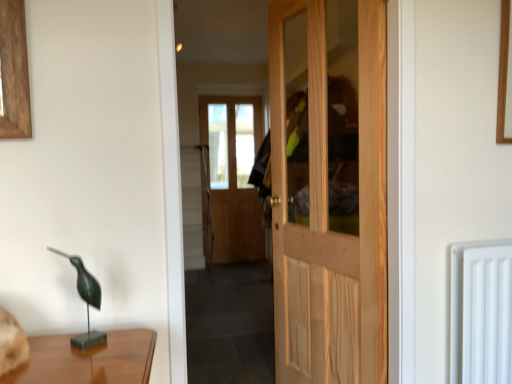
Where is `natural wood door at center`? This screenshot has height=384, width=512. natural wood door at center is located at coordinates (328, 196).

What do you see at coordinates (328, 196) in the screenshot?
I see `natural wood door at center` at bounding box center [328, 196].

Where is `white plastic radiator at right`? The image size is (512, 384). white plastic radiator at right is located at coordinates (481, 312).

Is natural wood door at center not near white plastic radiator at right?

No, there isn't a large distance between natural wood door at center and white plastic radiator at right.

Where is `door behind the white plastic radiator at right`? The height and width of the screenshot is (384, 512). door behind the white plastic radiator at right is located at coordinates (328, 196).

Is point (375, 76) more distant than point (496, 301)?

Yes, point (375, 76) is farther from viewer.

From a real-world perspective, is natural wood door at center positioned under white plastic radiator at right based on gravity?

No, from a real-world perspective, natural wood door at center is not below white plastic radiator at right.

From a real-world perspective, is natural wood door at center beneath green patina metal bird at left?

Actually, natural wood door at center is physically above green patina metal bird at left in the real world.

Looking at this image, how far apart are natural wood door at center and green patina metal bird at left?

A distance of 1.25 meters exists between natural wood door at center and green patina metal bird at left.

Considering the sizes of objects natural wood door at center and green patina metal bird at left in the image provided, who is thinner, natural wood door at center or green patina metal bird at left?

green patina metal bird at left is thinner.

Does natural wood door at center have a smaller size compared to green patina metal bird at left?

Incorrect, natural wood door at center is not smaller in size than green patina metal bird at left.

Locate an element on the screen. radiator lying below the natural wood door at center (from the image's perspective) is located at coordinates (481, 312).

How different are the orientations of white plastic radiator at right and natural wood door at center in degrees?

The angle between the facing direction of white plastic radiator at right and the facing direction of natural wood door at center is 72.3 degrees.

Would you say white plastic radiator at right is to the left or to the right of natural wood door at center in the picture?

From the image, it's evident that white plastic radiator at right is to the right of natural wood door at center.

In the scene shown: Which of these two, green patina metal bird at left or natural wood door at center, is smaller?

green patina metal bird at left is smaller.

From a real-world perspective, between green patina metal bird at left and natural wood door at center, who is vertically lower?

From a 3D spatial view, green patina metal bird at left is below.

Considering the positions of objects green patina metal bird at left and natural wood door at center in the image provided, who is behind, green patina metal bird at left or natural wood door at center?

natural wood door at center.

Is green patina metal bird at left with white plastic radiator at right?

There is a gap between green patina metal bird at left and white plastic radiator at right.

Based on their positions, is green patina metal bird at left located to the left or right of white plastic radiator at right?

Based on their positions, green patina metal bird at left is located to the left of white plastic radiator at right.

Which of these two, green patina metal bird at left or white plastic radiator at right, is wider?

With larger width is white plastic radiator at right.

Looking at this image, is white plastic radiator at right beside green patina metal bird at left?

There is a gap between white plastic radiator at right and green patina metal bird at left.

Is white plastic radiator at right located outside green patina metal bird at left?

Yes, white plastic radiator at right is located beyond the bounds of green patina metal bird at left.

Where is `door above the white plastic radiator at right (from the image's perspective)`? The image size is (512, 384). door above the white plastic radiator at right (from the image's perspective) is located at coordinates [x=328, y=196].

Locate an element on the screen. This screenshot has height=384, width=512. door behind the green patina metal bird at left is located at coordinates (328, 196).

Which object lies nearer to the anchor point white plastic radiator at right, green patina metal bird at left or natural wood door at center?

The object closer to white plastic radiator at right is natural wood door at center.

Looking at the image, which one is located further to natural wood door at center, white plastic radiator at right or green patina metal bird at left?

green patina metal bird at left lies further to natural wood door at center than the other object.

Looking at the image, which one is located further to green patina metal bird at left, natural wood door at center or white plastic radiator at right?

Based on the image, natural wood door at center appears to be further to green patina metal bird at left.

From the image, which object appears to be farther from natural wood door at center, green patina metal bird at left or white plastic radiator at right?

green patina metal bird at left is positioned further to the anchor natural wood door at center.

Which object lies nearer to the anchor point green patina metal bird at left, white plastic radiator at right or natural wood door at center?

Based on the image, white plastic radiator at right appears to be nearer to green patina metal bird at left.

When comparing their distances from white plastic radiator at right, does natural wood door at center or green patina metal bird at left seem closer?

natural wood door at center.

Identify the location of door located between green patina metal bird at left and white plastic radiator at right in the left-right direction. (328, 196).